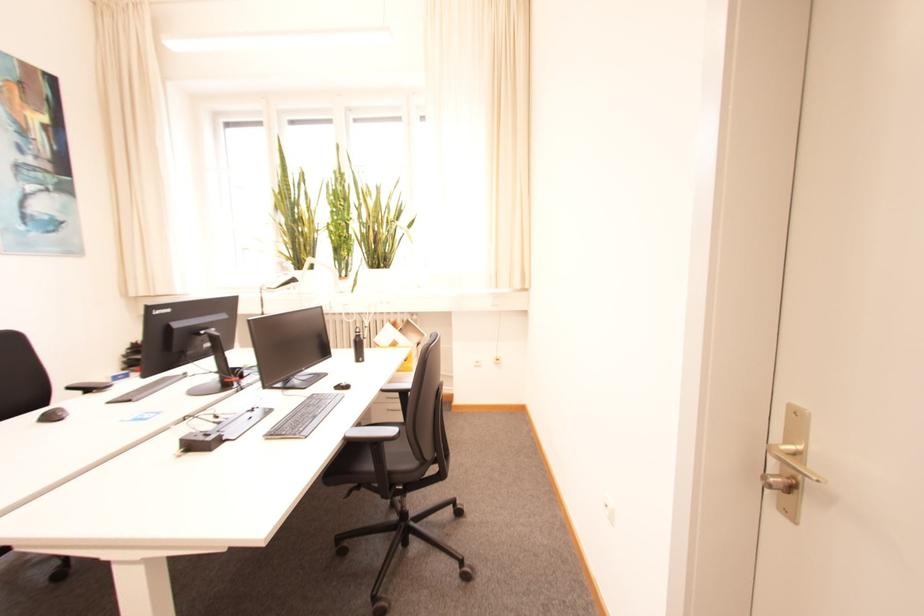
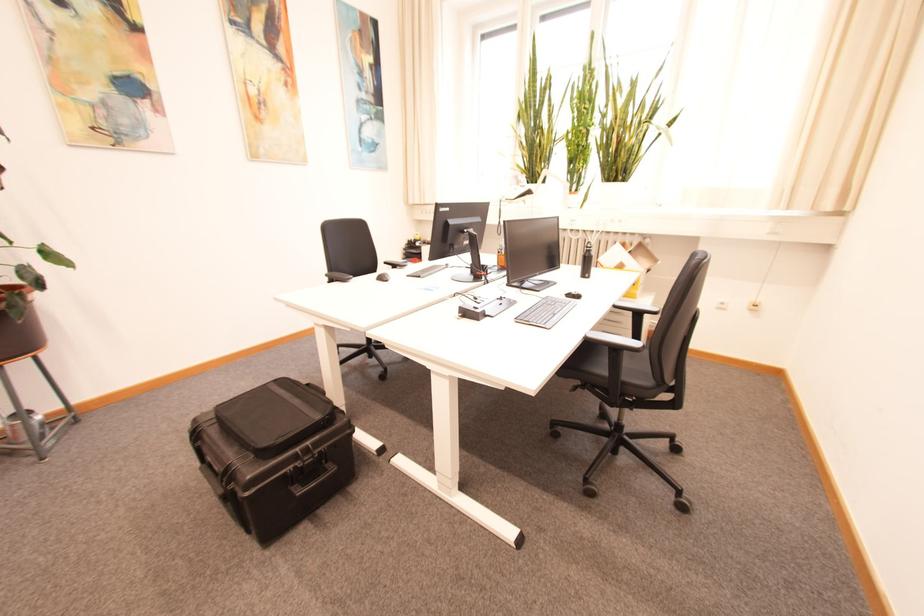
The point at (348,438) is marked in the first image. Where is the corresponding point in the second image?

(590, 337)